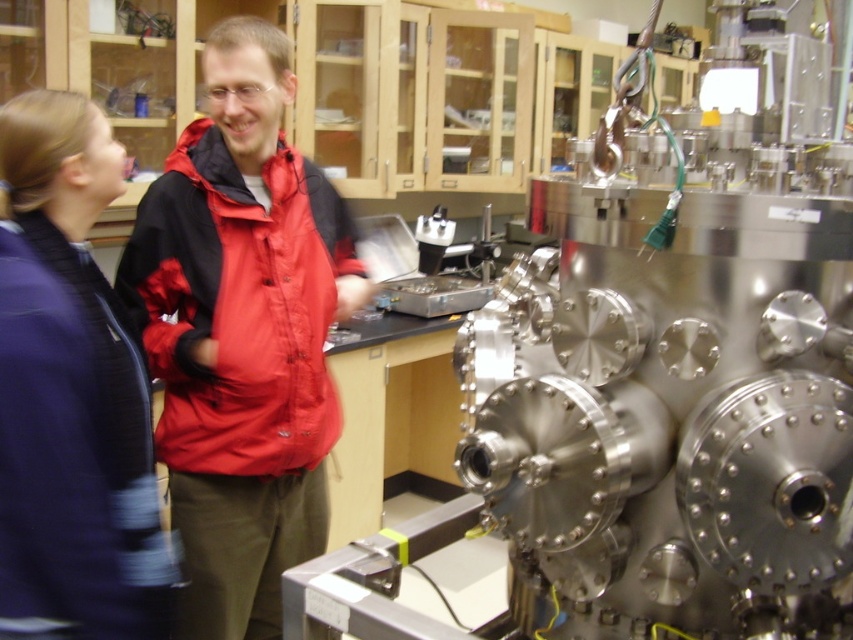
In the scene shown: You are an observer in the laboratory scene. You notice the blue fabric jacket at left and the red nylon jacket at center. Which jacket appears taller in the image?

The blue fabric jacket at left appears taller than the red nylon jacket at center.

You are standing in a laboratory and need to locate the red matte jacket at center. According to the coordinates provided, where should you look to find it?

The red matte jacket at center is located at coordinates point (242, 333).

From the picture: You are standing in the laboratory scene described. There is a point at coordinates (242, 333). Which object from the scene is exactly at this point?

The red matte jacket at center is located at point (242, 333).